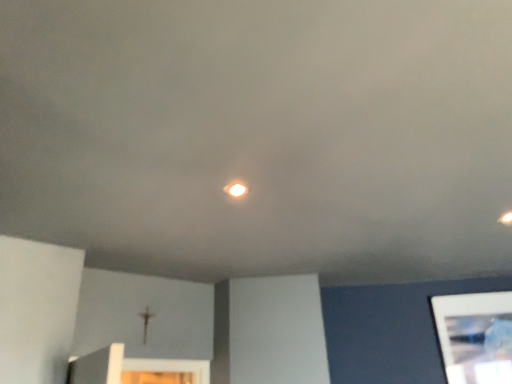
The width and height of the screenshot is (512, 384). Describe the element at coordinates (475, 336) in the screenshot. I see `white glossy tablet at lower right` at that location.

Image resolution: width=512 pixels, height=384 pixels. Find the location of `white glossy tablet at lower right`. white glossy tablet at lower right is located at coordinates (475, 336).

The image size is (512, 384). What do you see at coordinates (236, 189) in the screenshot?
I see `matte white light at center` at bounding box center [236, 189].

At what (x,y) coordinates should I click in order to perform the action: click on matte white light at center. Please return your answer as a coordinate pair (x, y). Looking at the image, I should click on (236, 189).

I want to click on white glossy tablet at lower right, so click(475, 336).

Is white glossy tablet at lower right to the left of matte white light at center from the viewer's perspective?

No.

Considering the positions of objects white glossy tablet at lower right and matte white light at center in the image provided, who is in front, white glossy tablet at lower right or matte white light at center?

matte white light at center is closer to the camera.

Which is closer, [505,378] or [239,195]?

Point [505,378].

From the image's perspective, which object appears higher, white glossy tablet at lower right or matte white light at center?

matte white light at center appears higher in the image.

From a real-world perspective, is white glossy tablet at lower right above or below matte white light at center?

From a real-world perspective, white glossy tablet at lower right is physically below matte white light at center.

Is white glossy tablet at lower right thinner than matte white light at center?

Indeed, white glossy tablet at lower right has a lesser width compared to matte white light at center.

Between white glossy tablet at lower right and matte white light at center, which one has more height?

Standing taller between the two is white glossy tablet at lower right.

Is white glossy tablet at lower right bigger or smaller than matte white light at center?

Clearly, white glossy tablet at lower right is larger in size than matte white light at center.

Is matte white light at center surrounded by white glossy tablet at lower right?

That's incorrect, matte white light at center is not inside white glossy tablet at lower right.

Is white glossy tablet at lower right not near matte white light at center?

Absolutely, white glossy tablet at lower right is distant from matte white light at center.

Consider the image. Is white glossy tablet at lower right facing towards matte white light at center?

No.

Measure the distance from white glossy tablet at lower right to matte white light at center.

white glossy tablet at lower right is 6.42 feet from matte white light at center.

You are a GUI agent. You are given a task and a screenshot of the screen. Output one action in this format:
    pyautogui.click(x=<x>, y=<y>)
    Task: Click on the light above the white glossy tablet at lower right (from a real-world perspective)
    The image size is (512, 384).
    Given the screenshot: What is the action you would take?
    pyautogui.click(x=236, y=189)

Is matte white light at center to the right of white glossy tablet at lower right from the viewer's perspective?

No.

From the picture: Is the depth of matte white light at center less than that of white glossy tablet at lower right?

Yes, it is.

Does point (234, 183) come behind point (445, 355)?

No.

From the image's perspective, is matte white light at center beneath white glossy tablet at lower right?

Actually, matte white light at center appears above white glossy tablet at lower right in the image.

From a real-world perspective, is matte white light at center below white glossy tablet at lower right?

Actually, matte white light at center is physically above white glossy tablet at lower right in the real world.

Between matte white light at center and white glossy tablet at lower right, which one has larger width?

Wider between the two is matte white light at center.

Consider the image. Between matte white light at center and white glossy tablet at lower right, which one has less height?

Standing shorter between the two is matte white light at center.

Looking at this image, considering the relative sizes of matte white light at center and white glossy tablet at lower right in the image provided, is matte white light at center bigger than white glossy tablet at lower right?

Incorrect, matte white light at center is not larger than white glossy tablet at lower right.

Is white glossy tablet at lower right surrounded by matte white light at center?

No, white glossy tablet at lower right is not inside matte white light at center.

From the picture: Would you consider matte white light at center to be distant from white glossy tablet at lower right?

Indeed, matte white light at center is not near white glossy tablet at lower right.

Is matte white light at center positioned with its back to white glossy tablet at lower right?

No.

Locate an element on the screen. The width and height of the screenshot is (512, 384). picture frame that is below the matte white light at center (from the image's perspective) is located at coordinates (475, 336).

Where is `picture frame below the matte white light at center (from the image's perspective)`? This screenshot has width=512, height=384. picture frame below the matte white light at center (from the image's perspective) is located at coordinates (475, 336).

Identify the location of picture frame that appears below the matte white light at center (from a real-world perspective). (475, 336).